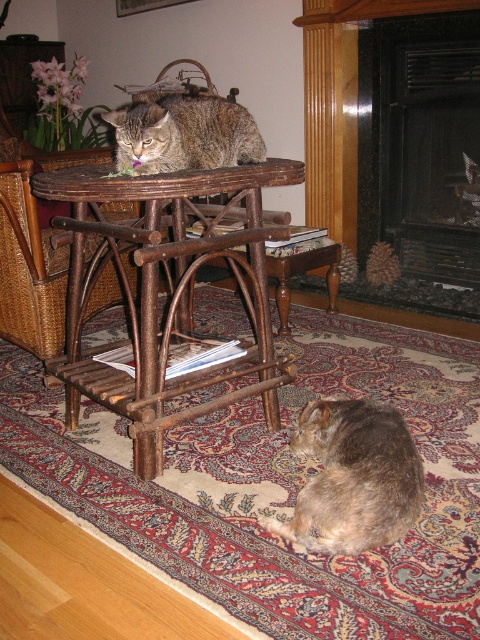
You are standing in the room and want to place a small toy between the two cats. The first cat is at point (406, 451) and the second cat is at point (190, 157). Which cat is closer to you so you can toss the toy towards it first?

The cat at point (406, 451) is closer to you than the cat at point (190, 157), so you should toss the toy towards the cat at point (406, 451) first.

You are a photographer trying to capture both cats in a single shot. The camera is positioned so that you can see the brown wood table at center clearly. Since the brown shaggy cat at lower center is behind the table, will it be visible in your photo?

The brown shaggy cat at lower center is behind the brown wood table at center, so it might not be fully visible in the photo unless the table is transparent or the cat is partially visible around the edges.